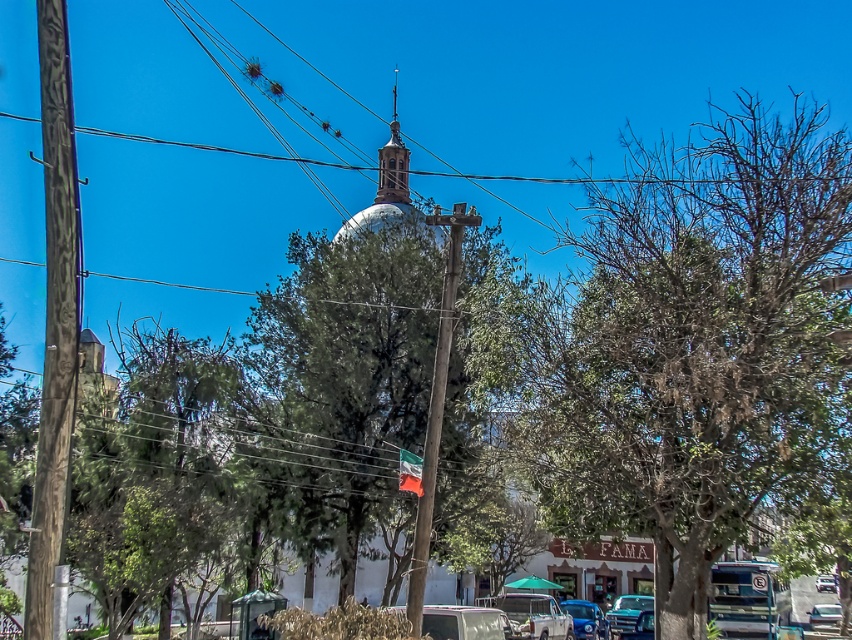
Between point (668, 173) and point (519, 612), which one is positioned behind?

The point (519, 612) is more distant.

Where is `green leafy tree at upper right`? green leafy tree at upper right is located at coordinates (694, 342).

Who is more forward, (x=774, y=177) or (x=499, y=609)?

Positioned in front is point (x=774, y=177).

In order to click on green leafy tree at upper right in this screenshot , I will do `click(694, 342)`.

Does metallic silver truck at lower center have a greater height compared to white matte van at lower center?

No, metallic silver truck at lower center is not taller than white matte van at lower center.

Between point (481, 604) and point (403, 611), which one is positioned behind?

Point (481, 604)

Does point (521, 605) come behind point (486, 630)?

Yes, it is.

This screenshot has width=852, height=640. I want to click on metallic silver truck at lower center, so click(530, 616).

Who is positioned more to the left, white matte van at lower center or metallic silver car at center?

white matte van at lower center

Consider the image. Is white matte van at lower center below metallic silver car at center?

Incorrect, white matte van at lower center is not positioned below metallic silver car at center.

Is point (481, 624) positioned behind point (824, 577)?

No, (481, 624) is in front of (824, 577).

The width and height of the screenshot is (852, 640). I want to click on white matte van at lower center, so coord(459,621).